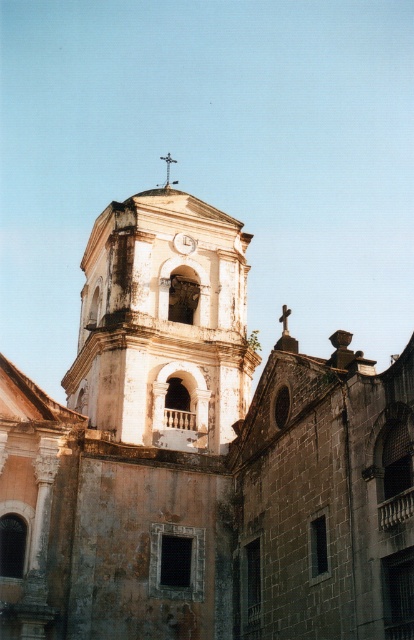
Does white stone bell tower at center appear under metallic silver clock at center?

Indeed, white stone bell tower at center is positioned under metallic silver clock at center.

Does white stone bell tower at center appear over metallic silver clock at center?

No.

The height and width of the screenshot is (640, 414). Identify the location of white stone bell tower at center. (163, 324).

At what (x,y) coordinates should I click in order to perform the action: click on white stone bell tower at center. Please return your answer as a coordinate pair (x, y). Image resolution: width=414 pixels, height=640 pixels. Looking at the image, I should click on (163, 324).

Does metallic silver clock at center come behind metallic cross at upper center?

No, it is not.

Is metallic silver clock at center to the left of metallic cross at upper center from the viewer's perspective?

In fact, metallic silver clock at center is to the right of metallic cross at upper center.

This screenshot has width=414, height=640. Find the location of `metallic silver clock at center`. metallic silver clock at center is located at coordinates (183, 243).

Does white stone bell tower at center have a lesser width compared to metallic cross at upper center?

Incorrect, white stone bell tower at center's width is not less than metallic cross at upper center's.

Between point (88, 289) and point (166, 180), which one is positioned in front?

Positioned in front is point (88, 289).

Does point (194, 198) lie behind point (166, 157)?

No.

Identify the location of white stone bell tower at center. The image size is (414, 640). (163, 324).